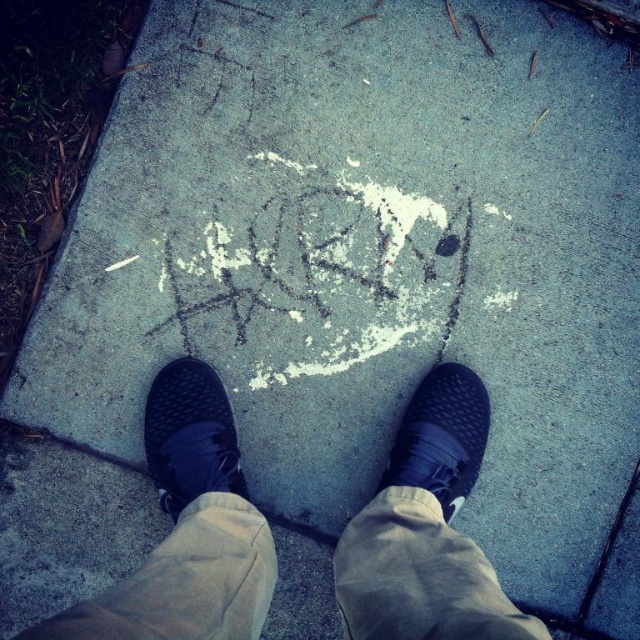
Is white chalk writing at center thinner than black mesh shoe at center?

No.

Can you confirm if white chalk writing at center is positioned to the right of black mesh shoe at center?

In fact, white chalk writing at center is to the left of black mesh shoe at center.

Which is behind, point (256, 310) or point (476, 422)?

The point (256, 310) is behind.

Locate an element on the screen. white chalk writing at center is located at coordinates (317, 275).

Which of these two, black mesh shoe at lower left or black mesh shoe at center, stands shorter?

Standing shorter between the two is black mesh shoe at center.

Can you confirm if black mesh shoe at lower left is shorter than black mesh shoe at center?

No, black mesh shoe at lower left is not shorter than black mesh shoe at center.

You are a GUI agent. You are given a task and a screenshot of the screen. Output one action in this format:
    pyautogui.click(x=<x>, y=<y>)
    Task: Click on the black mesh shoe at lower left
    
    Given the screenshot: What is the action you would take?
    pyautogui.click(x=189, y=435)

The width and height of the screenshot is (640, 640). In order to click on black mesh sneakers at center in this screenshot , I will do `click(188, 529)`.

You are a GUI agent. You are given a task and a screenshot of the screen. Output one action in this format:
    pyautogui.click(x=<x>, y=<y>)
    Task: Click on the black mesh sneakers at center
    This screenshot has width=640, height=640.
    Given the screenshot: What is the action you would take?
    pyautogui.click(x=188, y=529)

Where is `black mesh sneakers at center`? Image resolution: width=640 pixels, height=640 pixels. black mesh sneakers at center is located at coordinates (188, 529).